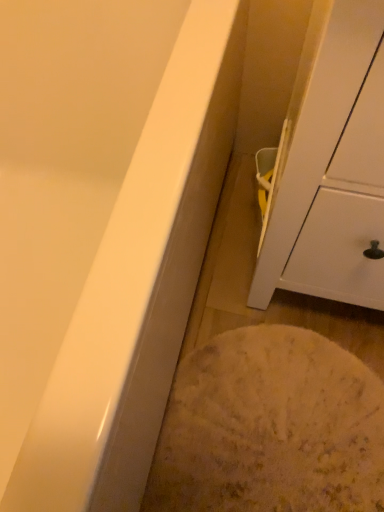
The width and height of the screenshot is (384, 512). I want to click on blank space above white textured rug at lower center (from a real-world perspective), so click(270, 420).